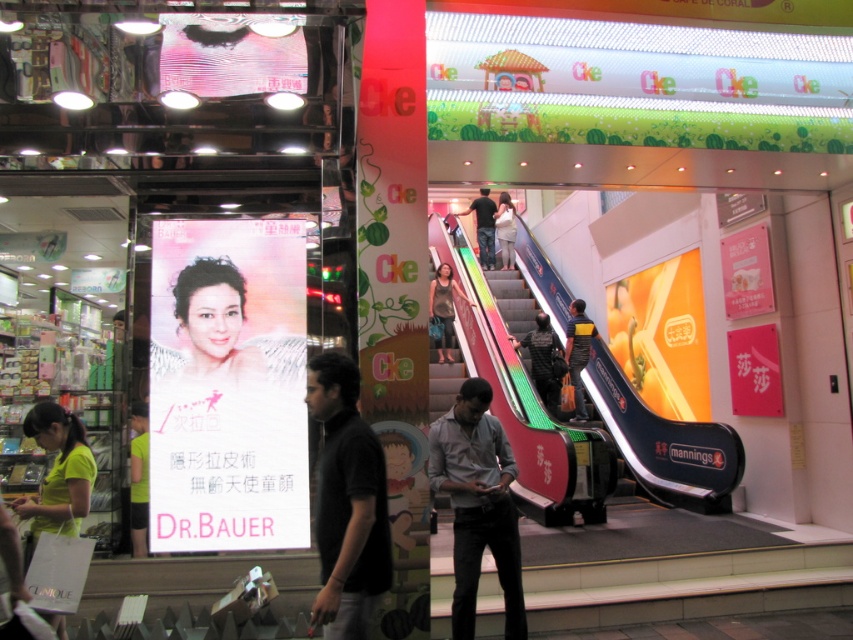
Question: Which point is closer to the camera?

Choices:
 (A) black matte shirt at center
 (B) dark gray fabric jacket at center
 (C) dark blue jeans at center

Answer: (A)

Question: Which object is farther from the camera taking this photo?

Choices:
 (A) orange glossy sign at upper right
 (B) black matte shirt at center

Answer: (A)

Question: In this image, where is light green fabric shirt at lower left located relative to dark blue jeans at center?

Choices:
 (A) below
 (B) above

Answer: (A)

Question: Can you confirm if matte silver hair at center is positioned to the right of dark gray fabric jacket at center?

Choices:
 (A) yes
 (B) no

Answer: (B)

Question: Which of the following is the closest to the observer?

Choices:
 (A) [561, 368]
 (B) [201, 330]
 (C) [485, 188]
 (D) [451, 326]

Answer: (B)

Question: From the image, what is the correct spatial relationship of gray cotton shirt at center in relation to light green fabric shirt at lower left?

Choices:
 (A) above
 (B) below

Answer: (B)